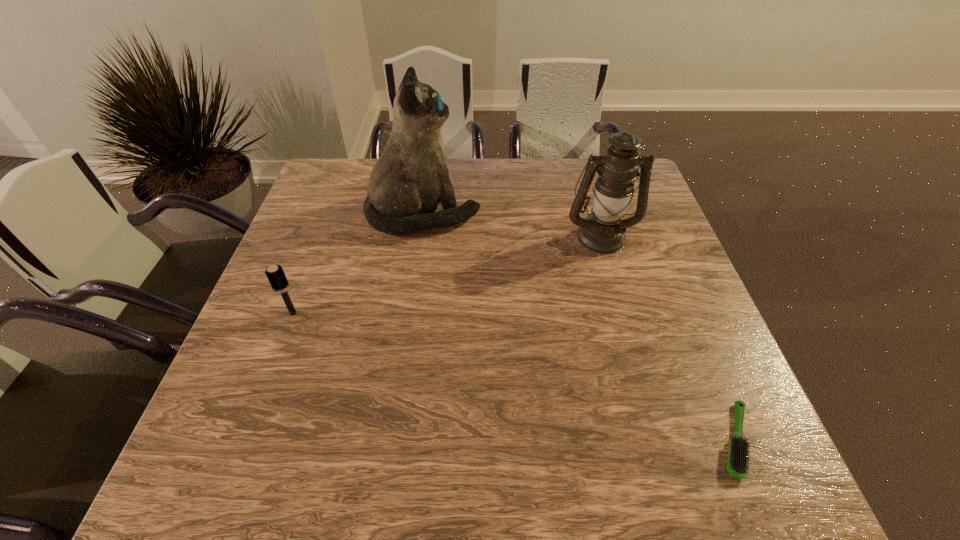
You are a GUI agent. You are given a task and a screenshot of the screen. Output one action in this format:
    pyautogui.click(x=<x>, y=<y>)
    Task: Click on the third object from right to left
    This screenshot has height=540, width=960.
    Given the screenshot: What is the action you would take?
    pyautogui.click(x=407, y=182)

At what (x,y) coordinates should I click in order to perform the action: click on cat. Please return your answer as a coordinate pair (x, y). The width and height of the screenshot is (960, 540). Looking at the image, I should click on coord(407,182).

The image size is (960, 540). Identify the location of oil lamp. (603, 231).

Where is `the leftmost object`? The image size is (960, 540). the leftmost object is located at coordinates (275, 274).

Identify the location of the second shortest object. (275, 274).

This screenshot has width=960, height=540. What are the coordinates of `the shortest object` in the screenshot? It's located at (737, 463).

At what (x,y) coordinates should I click in order to perform the action: click on the nearer hairbrush. Please return your answer as a coordinate pair (x, y). Looking at the image, I should click on (737, 463).

I want to click on free space located at the face of the cat, so click(568, 214).

Locate an element on the screen. This screenshot has width=960, height=540. vacant region located on the back of the oil lamp is located at coordinates (588, 190).

Identify the location of vacant area located 0.210m on the back of the third tallest object. (319, 246).